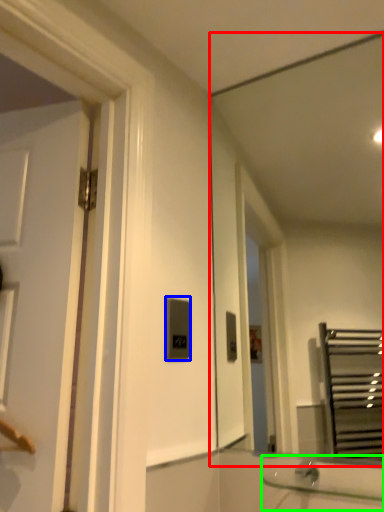
Question: Which object is the farthest from mirror (highlighted by a red box)? Choose among these: light switch (highlighted by a blue box) or sink (highlighted by a green box).

Choices:
 (A) light switch
 (B) sink

Answer: (B)